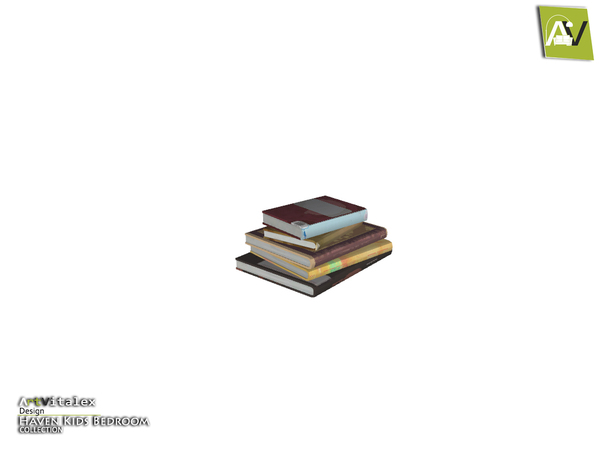
Locate an element on the screen. bottom book is located at coordinates (249, 260).